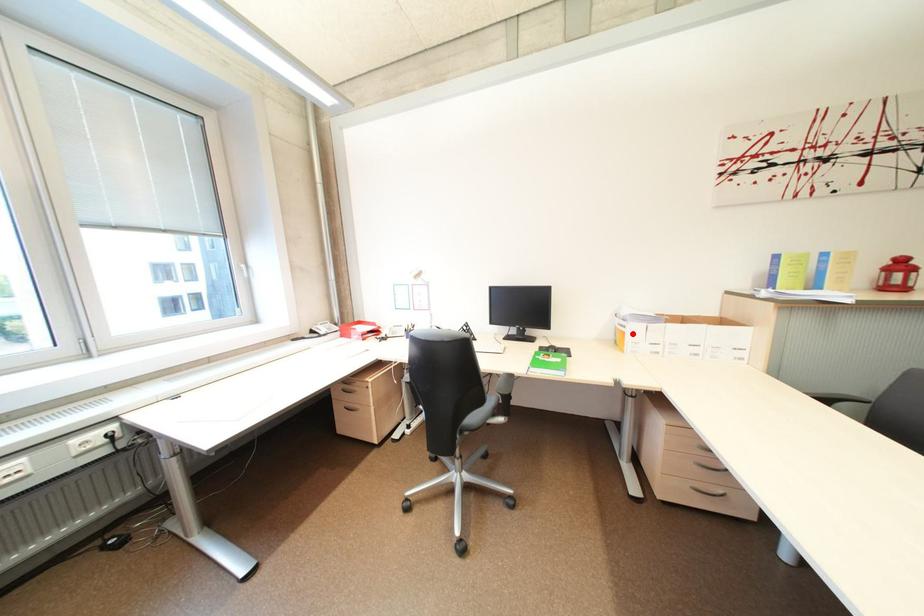
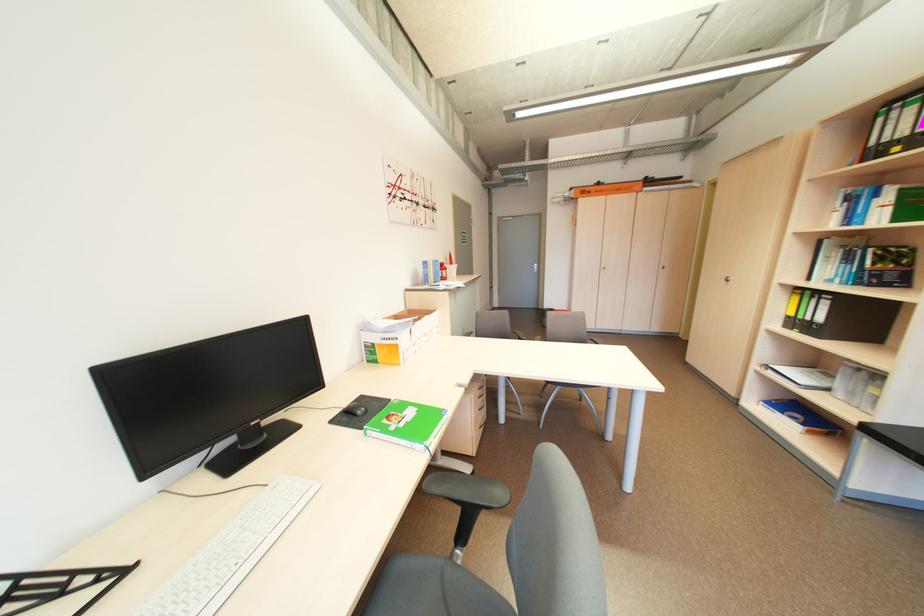
Question: I am providing you with two images of the same scene from different viewpoints. In image1, a red point is highlighted. Considering the same 3D point in image2, which of the following is correct?

Choices:
 (A) It is closer
 (B) It is farther

Answer: (B)